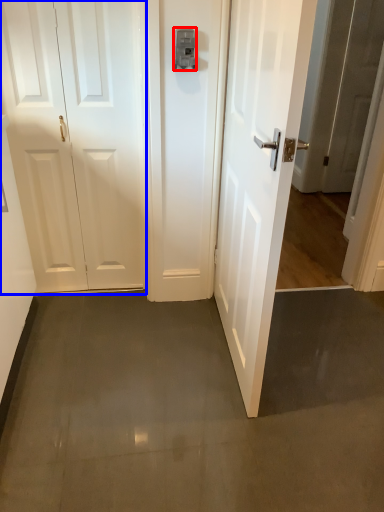
Question: Which point is further to the camera, latch (highlighted by a red box) or door (highlighted by a blue box)?

Choices:
 (A) latch
 (B) door

Answer: (B)